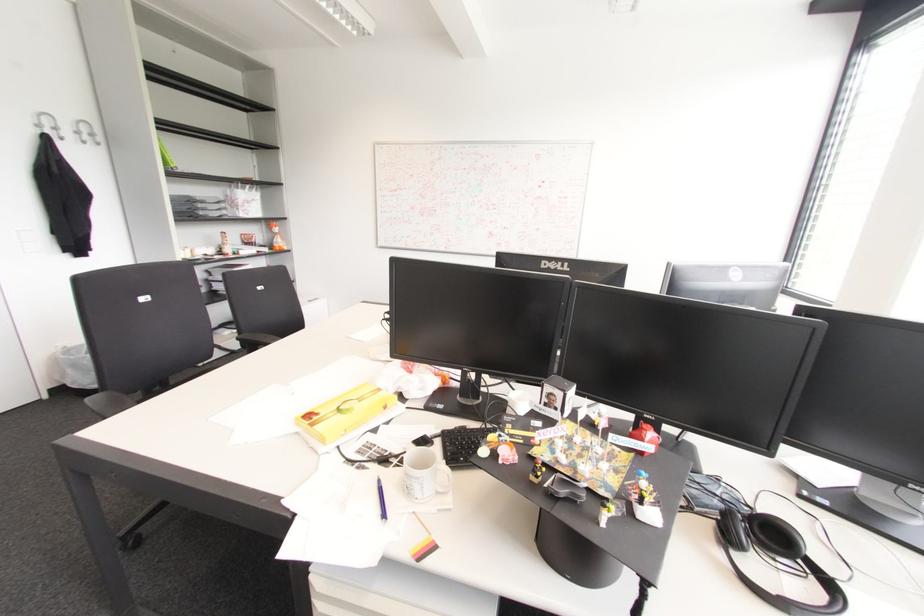
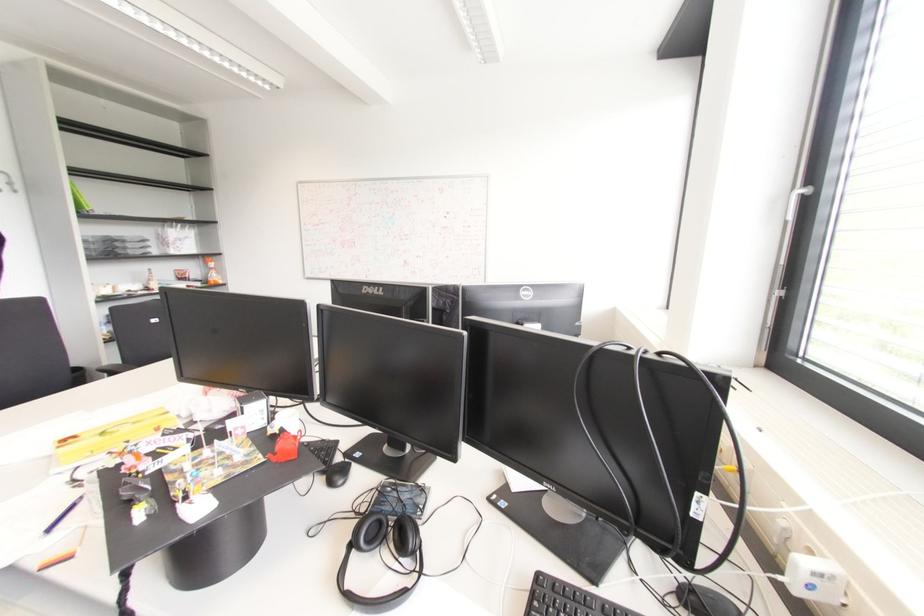
Question: In a continuous first-person perspective shot, in which direction is the camera moving?

Choices:
 (A) Left
 (B) Right
 (C) Forward
 (D) Backward

Answer: (B)